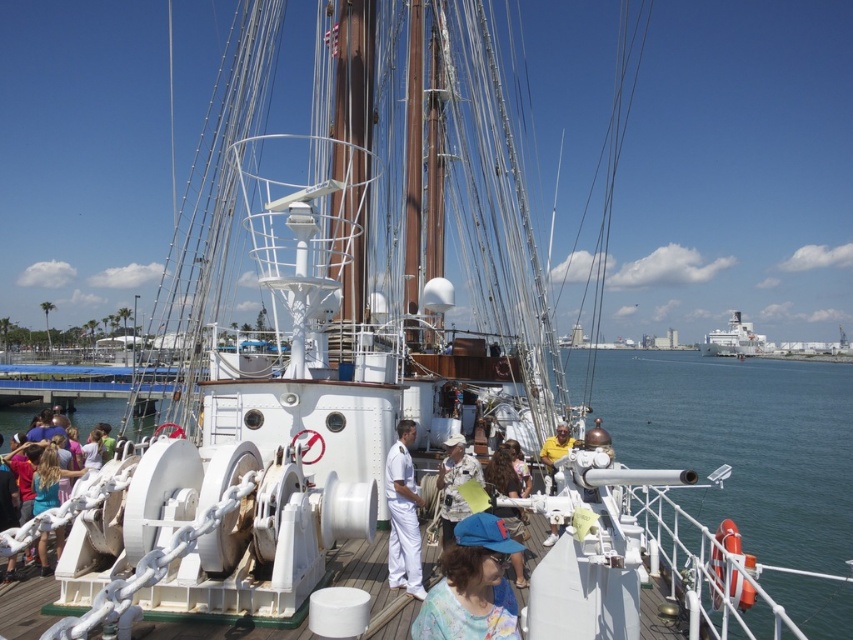
Question: Which of the following is the closest to the observer?

Choices:
 (A) white chain at lower left
 (B) yellow fabric shirt at center
 (C) clear blue water at center

Answer: (B)

Question: Is white matte water at center positioned before white matte uniform at center?

Choices:
 (A) no
 (B) yes

Answer: (A)

Question: Which object appears farthest from the camera in this image?

Choices:
 (A) clear blue water at center
 (B) white uniform at center
 (C) white chain at lower left
 (D) white matte water at center

Answer: (D)

Question: Among these objects, which one is nearest to the camera?

Choices:
 (A) white matte uniform at center
 (B) dark brown hair at center

Answer: (B)

Question: From the image, what is the correct spatial relationship of white matte uniform at center in relation to yellow fabric shirt at center?

Choices:
 (A) left
 (B) right

Answer: (A)

Question: In this image, where is white matte water at center located relative to blue fabric cap at center?

Choices:
 (A) below
 (B) above

Answer: (A)